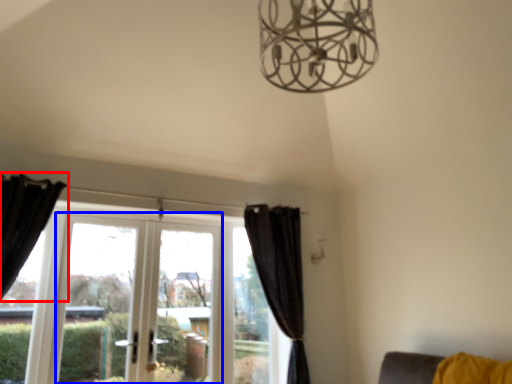
Question: Which of the following is the farthest to the observer, curtain (highlighted by a red box) or screen door (highlighted by a blue box)?

Choices:
 (A) curtain
 (B) screen door

Answer: (B)